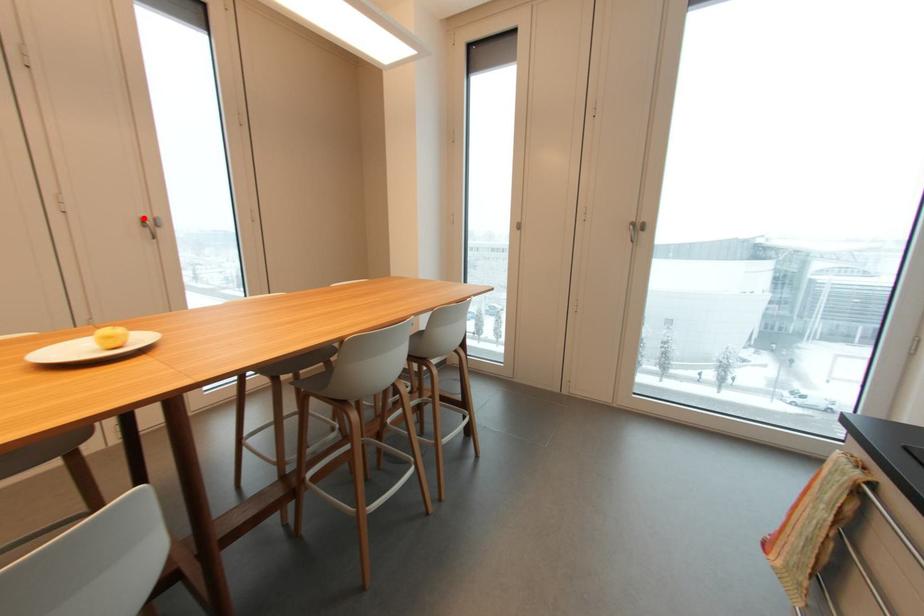
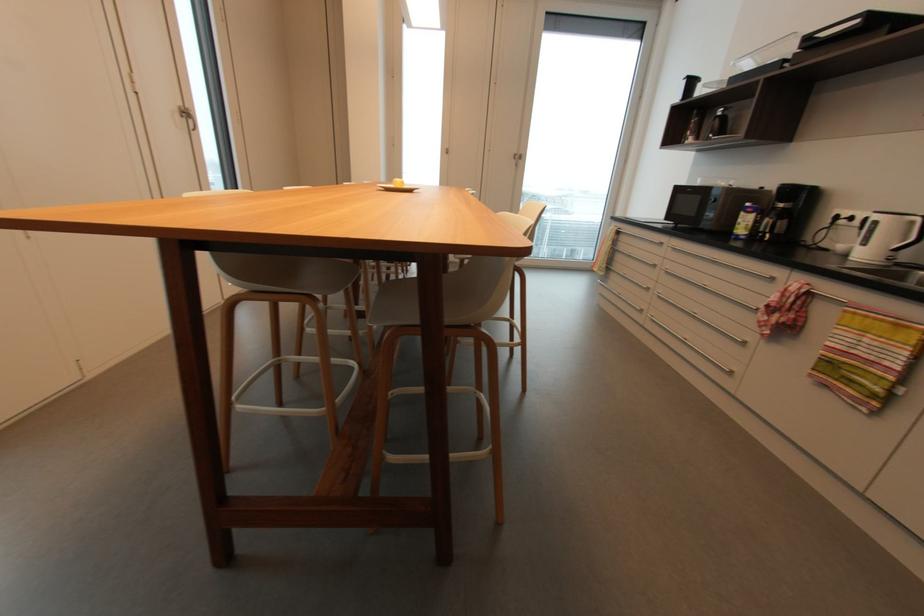
Find the pixel in the second image that matches the highlighted location in the first image.

(183, 108)